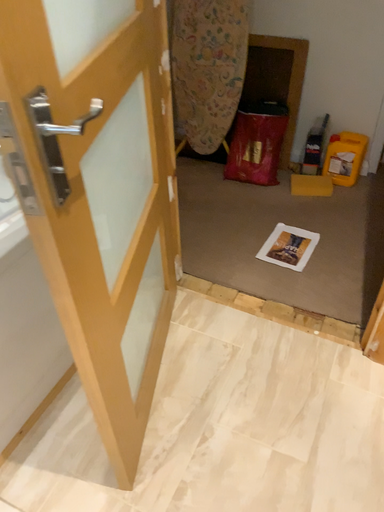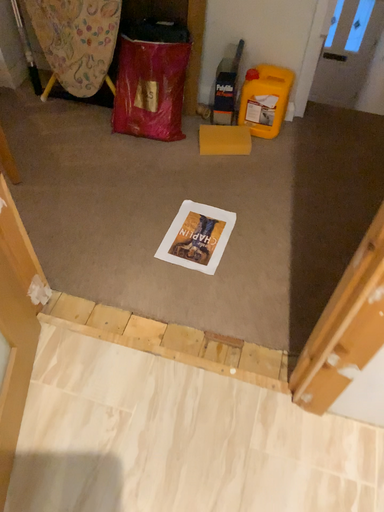
Question: How did the camera likely rotate when shooting the video?

Choices:
 (A) rotated upward
 (B) rotated downward

Answer: (B)